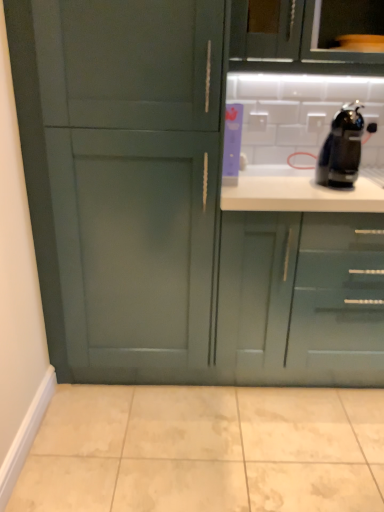
Question: Is the position of green matte cabinet at upper center, which is the second cabinetry in right-to-left order, more distant than that of black glossy coffee machine at upper right?

Choices:
 (A) no
 (B) yes

Answer: (B)

Question: Can black glossy coffee machine at upper right be found inside green matte cabinet at upper center, which is the second cabinetry in right-to-left order?

Choices:
 (A) no
 (B) yes

Answer: (A)

Question: Considering the relative sizes of green matte cabinet at upper center, which is the second cabinetry in right-to-left order, and black glossy coffee machine at upper right in the image provided, is green matte cabinet at upper center, which is the second cabinetry in right-to-left order, smaller than black glossy coffee machine at upper right?

Choices:
 (A) no
 (B) yes

Answer: (A)

Question: Is green matte cabinet at upper center, the second cabinetry in the left-to-right sequence, positioned beyond the bounds of black glossy coffee machine at upper right?

Choices:
 (A) yes
 (B) no

Answer: (A)

Question: Is green matte cabinet at upper center, the second cabinetry in the left-to-right sequence, taller than black glossy coffee machine at upper right?

Choices:
 (A) yes
 (B) no

Answer: (A)

Question: From a real-world perspective, is black glossy coffee machine at upper right positioned above or below beige marble tile at lower center?

Choices:
 (A) above
 (B) below

Answer: (A)

Question: Considering the positions of black glossy coffee machine at upper right and beige marble tile at lower center in the image, is black glossy coffee machine at upper right taller or shorter than beige marble tile at lower center?

Choices:
 (A) short
 (B) tall

Answer: (B)

Question: In terms of width, does black glossy coffee machine at upper right look wider or thinner when compared to beige marble tile at lower center?

Choices:
 (A) wide
 (B) thin

Answer: (B)

Question: Is black glossy coffee machine at upper right bigger or smaller than beige marble tile at lower center?

Choices:
 (A) big
 (B) small

Answer: (B)

Question: From the image's perspective, is green matte cabinet at upper center, which is the second cabinetry in right-to-left order, located above or below beige marble tile at lower center?

Choices:
 (A) above
 (B) below

Answer: (A)

Question: Is point (236, 71) closer or farther from the camera than point (357, 402)?

Choices:
 (A) farther
 (B) closer

Answer: (B)

Question: From a real-world perspective, is green matte cabinet at upper center, the second cabinetry in the left-to-right sequence, physically located above or below beige marble tile at lower center?

Choices:
 (A) below
 (B) above

Answer: (B)

Question: Looking at the image, does green matte cabinet at upper center, which is the second cabinetry in right-to-left order, seem bigger or smaller compared to beige marble tile at lower center?

Choices:
 (A) small
 (B) big

Answer: (B)

Question: Would you say green matte cabinet at upper center, the second cabinetry in the left-to-right sequence, is to the left or to the right of black glossy coffee machine at upper right in the picture?

Choices:
 (A) right
 (B) left

Answer: (B)

Question: Is green matte cabinet at upper center, the second cabinetry in the left-to-right sequence, inside the boundaries of black glossy coffee machine at upper right, or outside?

Choices:
 (A) inside
 (B) outside

Answer: (B)